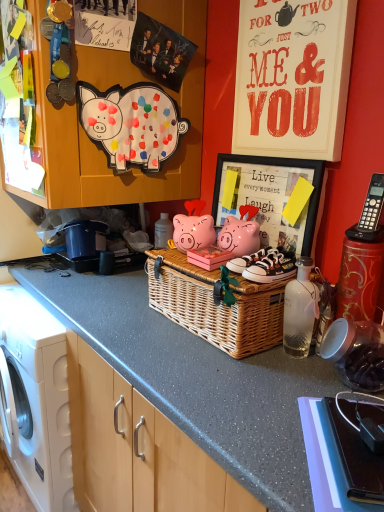
This screenshot has height=512, width=384. Identify the location of matte paper pig at upper left, the 2th pig positioned from the bottom. (131, 123).

Find the location of `white matte washing machine at left`. white matte washing machine at left is located at coordinates (36, 400).

Measure the distance between point (16, 398) and camera.

Point (16, 398) and camera are 1.69 meters apart.

Where is `white canvas sneakers at center, arranged as the second footwear when viewed from the back`? The image size is (384, 512). white canvas sneakers at center, arranged as the second footwear when viewed from the back is located at coordinates (272, 267).

Is wooden cabinet at upper left positioned with its back to black plastic phone at upper right?

wooden cabinet at upper left is not turned away from black plastic phone at upper right.

From the image's perspective, which object appears higher, wooden cabinet at upper left or black plastic phone at upper right?

wooden cabinet at upper left appears higher in the image.

Between wooden cabinet at upper left and black plastic phone at upper right, which one is positioned behind?

wooden cabinet at upper left is more distant.

Considering the positions of point (177, 197) and point (383, 501), is point (177, 197) closer or farther from the camera than point (383, 501)?

Point (177, 197) appears to be farther away from the viewer than point (383, 501).

Locate an element on the screen. The height and width of the screenshot is (512, 384). pig above the matte pink piggy bank at center, which ranks as the first pig in bottom-to-top order (from the image's perspective) is located at coordinates (131, 123).

Between matte paper pig at upper left, which is the first pig in top-to-bottom order, and matte pink piggy bank at center, the 2th pig positioned from the top, which one has less height?

With less height is matte pink piggy bank at center, the 2th pig positioned from the top.

Considering their positions, is matte paper pig at upper left, the 2th pig positioned from the bottom, located in front of or behind matte pink piggy bank at center, which ranks as the first pig in bottom-to-top order?

Visually, matte paper pig at upper left, the 2th pig positioned from the bottom, is located in front of matte pink piggy bank at center, which ranks as the first pig in bottom-to-top order.

Is matte paper pig at upper left, which is the first pig in top-to-bottom order, to the right of matte pink piggy bank at center, which ranks as the first pig in bottom-to-top order, from the viewer's perspective?

No.

Is wooden cabinet at upper left beside white matte washing machine at left?

wooden cabinet at upper left and white matte washing machine at left are not in contact.

Measure the distance between wooden cabinet at upper left and white matte washing machine at left.

wooden cabinet at upper left is 29.52 inches away from white matte washing machine at left.

You are a GUI agent. You are given a task and a screenshot of the screen. Output one action in this format:
    pyautogui.click(x=<x>, y=<y>)
    Task: Click on the cabinetry located above the white matte washing machine at left (from a real-world perspective)
    This screenshot has width=384, height=512.
    Given the screenshot: What is the action you would take?
    pyautogui.click(x=99, y=148)

Considering the relative sizes of wooden cabinet at upper left and white matte washing machine at left in the image provided, is wooden cabinet at upper left smaller than white matte washing machine at left?

Actually, wooden cabinet at upper left might be larger than white matte washing machine at left.

Who is taller, white paper at upper right or matte pink piggy bank at center, which ranks as the first pig in bottom-to-top order?

Standing taller between the two is white paper at upper right.

Locate an element on the screen. pig that is the 2nd one when counting downward from the white paper at upper right (from the image's perspective) is located at coordinates (192, 232).

From a real-world perspective, does white paper at upper right sit lower than matte pink piggy bank at center, the 2th pig positioned from the top?

Incorrect, from a real-world perspective, white paper at upper right is higher than matte pink piggy bank at center, the 2th pig positioned from the top.

How many degrees apart are the facing directions of white paper at upper right and matte pink piggy bank at center, the 2th pig positioned from the top?

0.00885 degrees separate the facing orientations of white paper at upper right and matte pink piggy bank at center, the 2th pig positioned from the top.

Can you tell me how much wooden framed picture at upper right and wooden cabinet at upper left differ in facing direction?

The angular difference between wooden framed picture at upper right and wooden cabinet at upper left is 90.6 degrees.

From the image's perspective, who appears lower, wooden framed picture at upper right or wooden cabinet at upper left?

wooden framed picture at upper right, from the image's perspective.

Is point (223, 164) farther from viewer compared to point (179, 97)?

No, it is in front of (179, 97).

Which is correct: wooden framed picture at upper right is inside white canvas sneakers at center, the first footwear viewed from the back, or outside of it?

wooden framed picture at upper right is spatially situated outside white canvas sneakers at center, the first footwear viewed from the back.

From a real-world perspective, which is physically below, wooden framed picture at upper right or white canvas sneakers at center, the first footwear viewed from the back?

white canvas sneakers at center, the first footwear viewed from the back, from a real-world perspective.

Considering the sizes of objects wooden framed picture at upper right and white canvas sneakers at center, the first footwear viewed from the back, in the image provided, who is shorter, wooden framed picture at upper right or white canvas sneakers at center, the first footwear viewed from the back,?

Standing shorter between the two is white canvas sneakers at center, the first footwear viewed from the back.

Does point (256, 352) appear closer or farther from the camera than point (48, 415)?

Point (256, 352) is positioned closer to the camera compared to point (48, 415).

Is woven wicker basket at center surrounding white matte washing machine at left?

Definitely not — white matte washing machine at left is not inside woven wicker basket at center.

Between woven wicker basket at center and white matte washing machine at left, which one has larger size?

With larger size is white matte washing machine at left.

From a real-world perspective, who is located higher, woven wicker basket at center or white matte washing machine at left?

In real-world perspective, woven wicker basket at center is above.

I want to click on cabinetry behind the black plastic phone at upper right, so click(99, 148).

Image resolution: width=384 pixels, height=512 pixels. Find the location of `pig to the right of matte paper pig at upper left, the 2th pig positioned from the bottom`. pig to the right of matte paper pig at upper left, the 2th pig positioned from the bottom is located at coordinates (192, 232).

Estimate the real-world distances between objects in this image. Which object is closer to wooden cabinet at upper left, white canvas sneakers at center, arranged as the first footwear when viewed from the front, or white canvas sneakers at center, the first footwear viewed from the back?

white canvas sneakers at center, the first footwear viewed from the back.

From the image, which object appears to be farther from white canvas sneakers at center, arranged as the first footwear when viewed from the front, transparent glass bottle at center or matte pink piggy bank at center, the 2th pig positioned from the top?

matte pink piggy bank at center, the 2th pig positioned from the top, is positioned further to the anchor white canvas sneakers at center, arranged as the first footwear when viewed from the front.

Based on their spatial positions, is matte paper pig at upper left, which is the first pig in top-to-bottom order, or transparent glass bottle at center further from white canvas sneakers at center, arranged as the second footwear when viewed from the back?

matte paper pig at upper left, which is the first pig in top-to-bottom order, lies further to white canvas sneakers at center, arranged as the second footwear when viewed from the back, than the other object.

Considering their positions, is black plastic phone at upper right positioned closer to matte pink piggy bank at center, which ranks as the first pig in bottom-to-top order, than white canvas sneakers at center, arranged as the second footwear when viewed from the back?

The object closer to matte pink piggy bank at center, which ranks as the first pig in bottom-to-top order, is white canvas sneakers at center, arranged as the second footwear when viewed from the back.

From the image, which object appears to be farther from matte pink piggy bank at center, the 2th pig positioned from the top, white matte washing machine at left or matte paper pig at upper left, which is the first pig in top-to-bottom order?

white matte washing machine at left is further to matte pink piggy bank at center, the 2th pig positioned from the top.

Based on their spatial positions, is matte pink piggy bank at center, which ranks as the first pig in bottom-to-top order, or wooden framed picture at upper right further from matte paper pig at upper left, the 2th pig positioned from the bottom?

wooden framed picture at upper right is further to matte paper pig at upper left, the 2th pig positioned from the bottom.

Based on their spatial positions, is wooden framed picture at upper right or matte paper pig at upper left, the 2th pig positioned from the bottom, further from woven wicker basket at center?

matte paper pig at upper left, the 2th pig positioned from the bottom, is further to woven wicker basket at center.

Based on their spatial positions, is matte paper pig at upper left, which is the first pig in top-to-bottom order, or wooden cabinet at upper left further from black plastic phone at upper right?

Based on the image, wooden cabinet at upper left appears to be further to black plastic phone at upper right.

Locate an element on the screen. This screenshot has height=512, width=384. picture frame between white paper at upper right and black plastic phone at upper right from top to bottom is located at coordinates (271, 197).

Locate an element on the screen. The image size is (384, 512). picture frame between white paper at upper right and matte pink piggy bank at center, which ranks as the first pig in bottom-to-top order, from top to bottom is located at coordinates (271, 197).

Find the location of a particular element. Image resolution: width=384 pixels, height=512 pixels. bottle located between black plastic phone at upper right and white canvas sneakers at center, which is counted as the 2th footwear, starting from the front, in the depth direction is located at coordinates (300, 310).

Where is `bottle between matte paper pig at upper left, the 2th pig positioned from the bottom, and white matte washing machine at left in the up-down direction`? The image size is (384, 512). bottle between matte paper pig at upper left, the 2th pig positioned from the bottom, and white matte washing machine at left in the up-down direction is located at coordinates (300, 310).